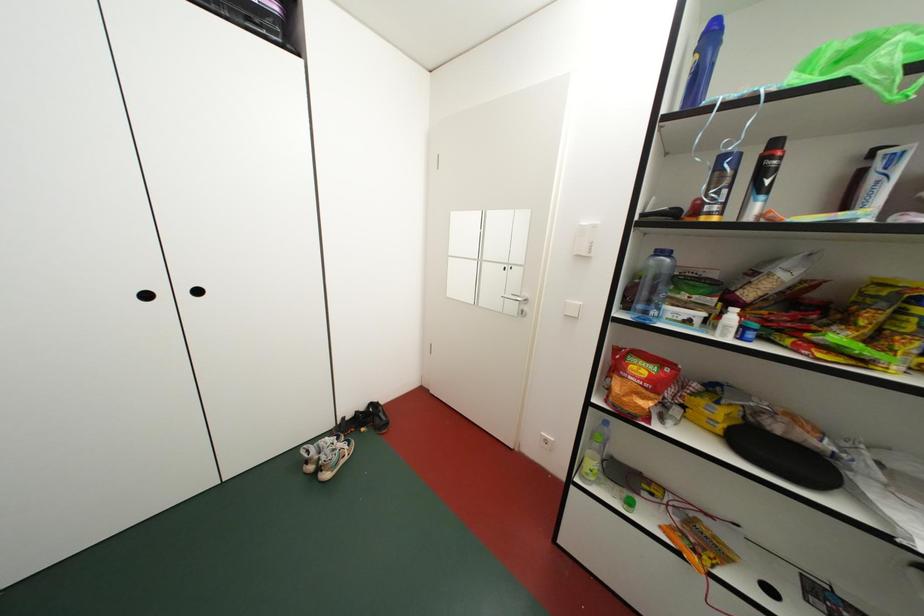
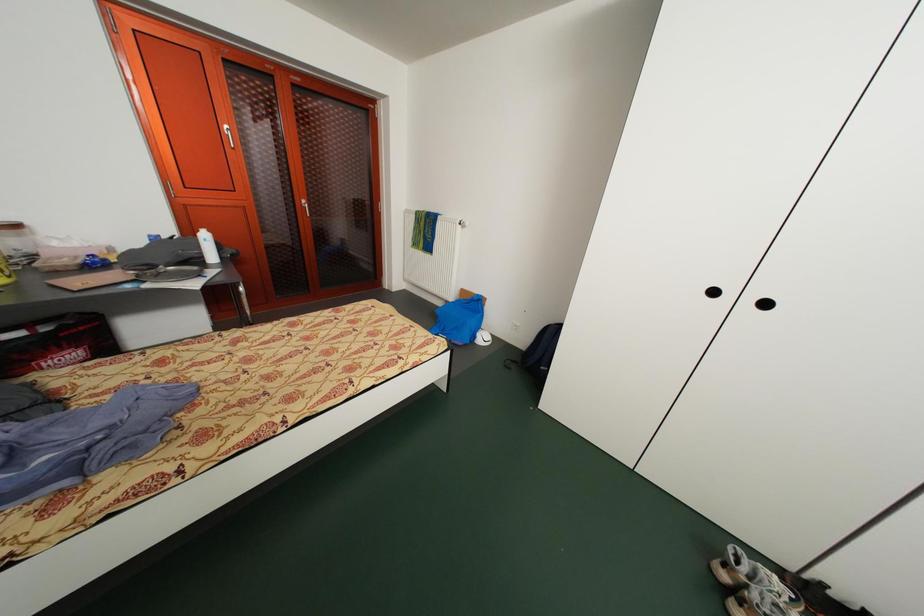
The images are taken continuously from a first-person perspective. In which direction is your viewpoint rotating?

The camera rotated toward left-down.